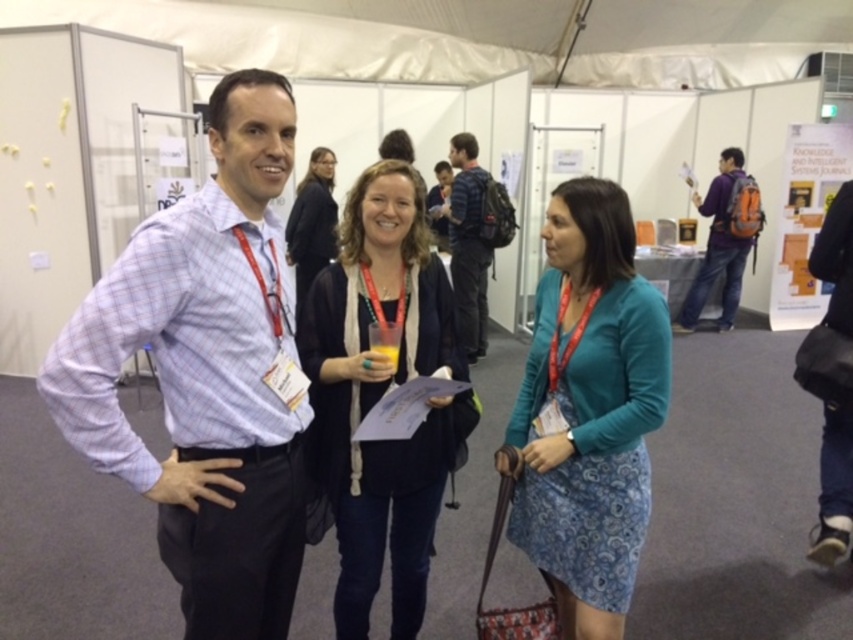
Question: Among these points, which one is farthest from the camera?

Choices:
 (A) (682, 307)
 (B) (320, 253)

Answer: (A)

Question: Can you confirm if plaid shirt at center is thinner than matte black jacket at center?

Choices:
 (A) no
 (B) yes

Answer: (A)

Question: Which point is farther to the camera?

Choices:
 (A) plaid shirt at center
 (B) blue printed dress at center
 (C) orange backpack at right

Answer: (C)

Question: Which object is positioned closest to the blue plaid shirt at center?

Choices:
 (A) orange backpack at right
 (B) matte black jacket at center

Answer: (B)

Question: Is blue printed dress at center smaller than matte black jacket at center?

Choices:
 (A) no
 (B) yes

Answer: (A)

Question: Does matte black cardigan at center appear over blue plaid shirt at center?

Choices:
 (A) yes
 (B) no

Answer: (B)